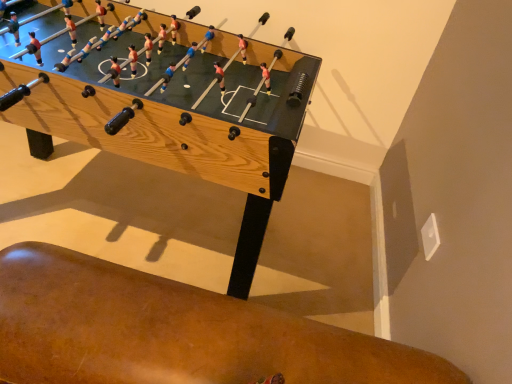
What is the approximate height of wooden foosball table at center?

The height of wooden foosball table at center is 81.88 centimeters.

This screenshot has height=384, width=512. I want to click on wooden foosball table at center, so click(172, 110).

This screenshot has width=512, height=384. What do you see at coordinates (172, 110) in the screenshot? I see `wooden foosball table at center` at bounding box center [172, 110].

Find the location of a particular element. This screenshot has height=384, width=512. wooden foosball table at center is located at coordinates (172, 110).